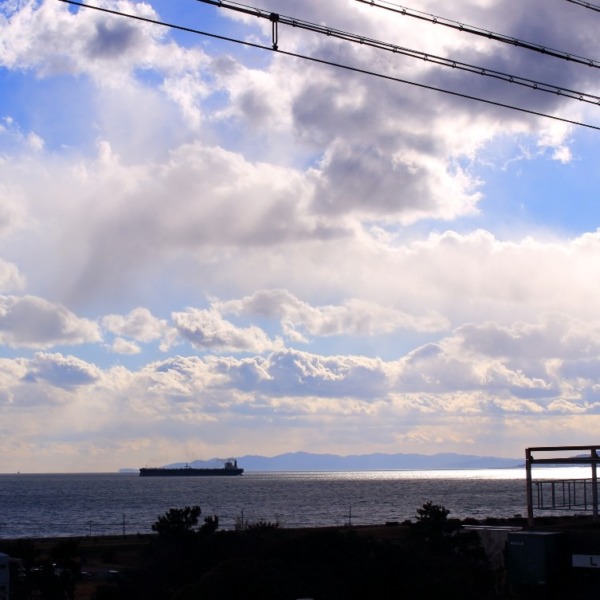
Where is `blue metal box on the bottom right`? blue metal box on the bottom right is located at coordinates (526, 547).